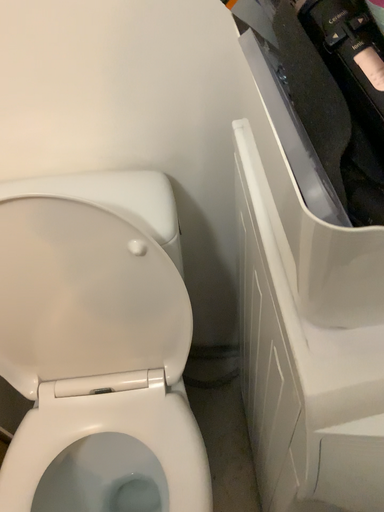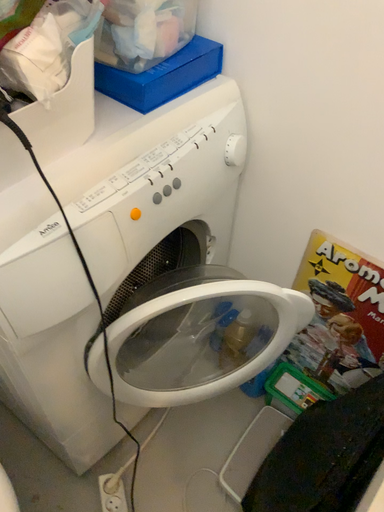
Question: How did the camera likely rotate when shooting the video?

Choices:
 (A) rotated left
 (B) rotated right

Answer: (B)